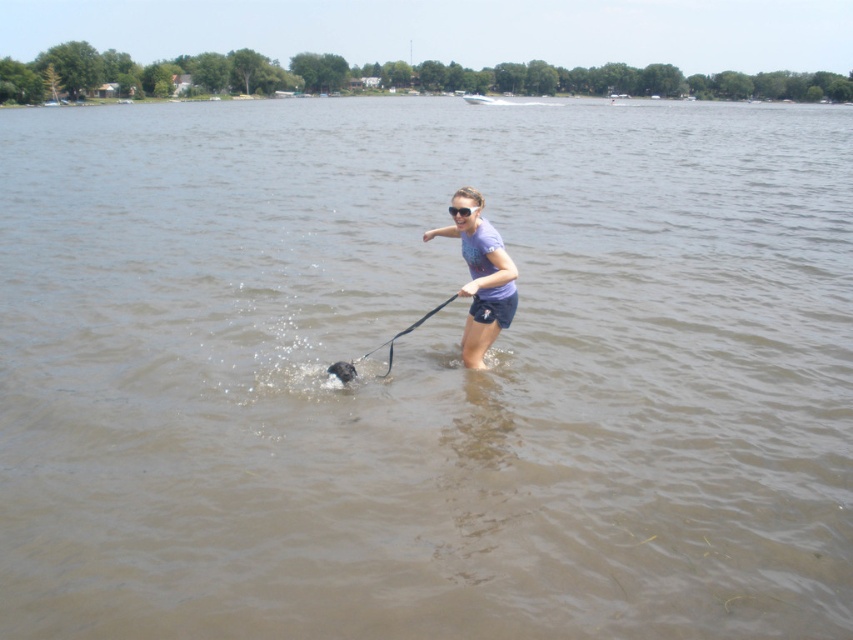
Question: Which point is closer to the camera?

Choices:
 (A) (451, 216)
 (B) (486, 339)

Answer: (A)

Question: Which is farther from the shiny black dog at center?

Choices:
 (A) transparent plastic goggles at center
 (B) black rubber paddle at center
 (C) purple cotton t-shirt at center

Answer: (A)

Question: From the image, what is the correct spatial relationship of black rubber paddle at center in relation to shiny black dog at center?

Choices:
 (A) above
 (B) below

Answer: (A)

Question: Is black rubber paddle at center further to camera compared to transparent plastic goggles at center?

Choices:
 (A) yes
 (B) no

Answer: (B)

Question: Is purple cotton t-shirt at center positioned in front of transparent plastic goggles at center?

Choices:
 (A) no
 (B) yes

Answer: (B)

Question: Which point is closer to the camera?

Choices:
 (A) transparent plastic goggles at center
 (B) shiny black dog at center

Answer: (A)